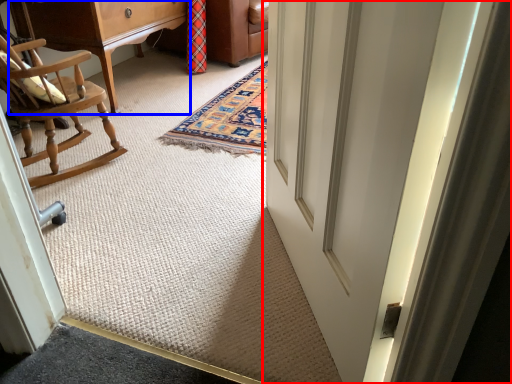
Question: Which object is closer to the camera taking this photo, door (highlighted by a red box) or furniture (highlighted by a blue box)?

Choices:
 (A) door
 (B) furniture

Answer: (A)